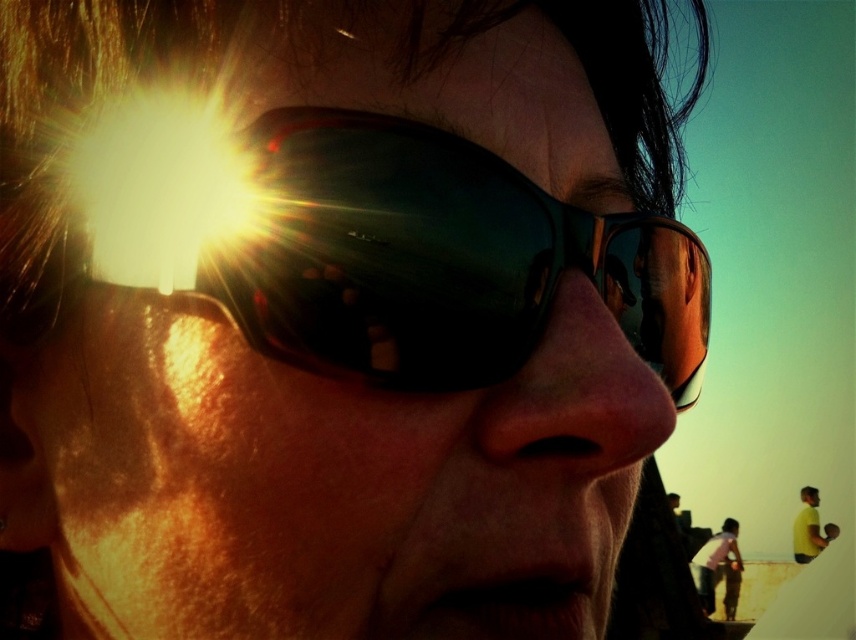
Does point (605, 221) come behind point (801, 497)?

No, it is not.

From the picture: Does shiny black goggles at center have a lesser width compared to yellow matte shirt at lower right?

Yes.

Does point (188, 209) come farther from viewer compared to point (813, 516)?

No, it is in front of (813, 516).

Find the location of a particular element. The width and height of the screenshot is (856, 640). shiny black goggles at center is located at coordinates (388, 246).

Can you confirm if shiny black goggles at center is positioned to the right of light pink shirt at lower right?

No, shiny black goggles at center is not to the right of light pink shirt at lower right.

Between point (122, 228) and point (716, 540), which one is positioned in front?

Point (122, 228) is in front.

Find the location of a particular element. Image resolution: width=856 pixels, height=640 pixels. shiny black goggles at center is located at coordinates (388, 246).

Between light pink shirt at lower right and yellow matte shirt at lower right, which one appears on the left side from the viewer's perspective?

Positioned to the left is light pink shirt at lower right.

Is light pink shirt at lower right to the left of yellow matte shirt at lower right from the viewer's perspective?

Correct, you'll find light pink shirt at lower right to the left of yellow matte shirt at lower right.

Does point (723, 550) lie behind point (803, 552)?

That is False.

What are the coordinates of `light pink shirt at lower right` in the screenshot? It's located at (715, 561).